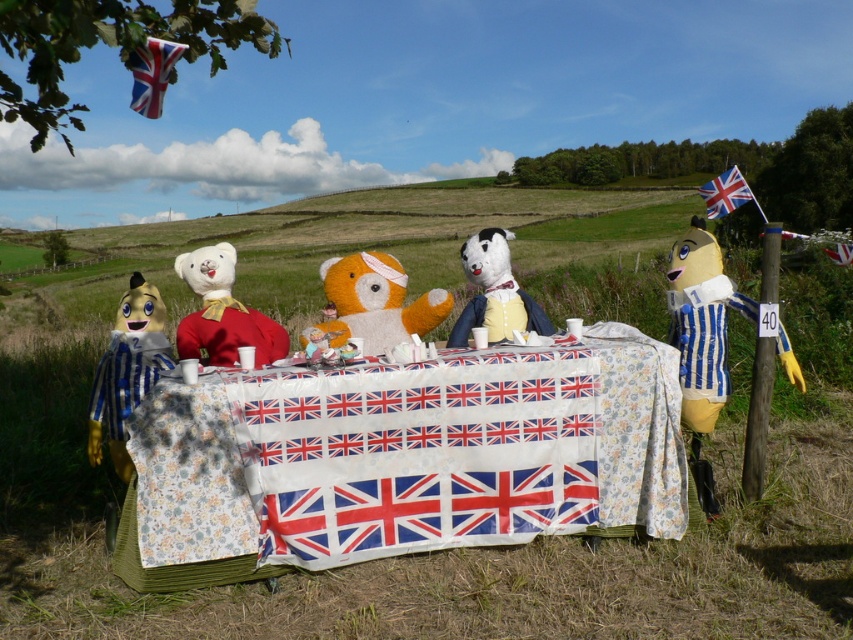
Looking at this image, you are standing 5 meters away from the center of the scene. Can you see the point located at coordinates point (693, 276) in the scene?

The distance of point (693, 276) from viewer is 4.40 meters, so yes, you can see the point located at coordinates point (693, 276) in the scene since it is within your 5 meters range.